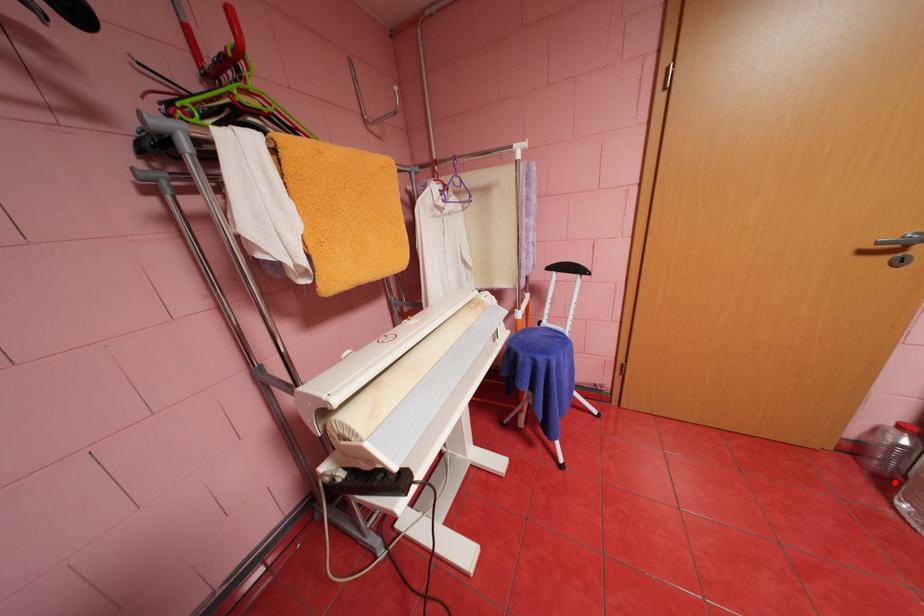
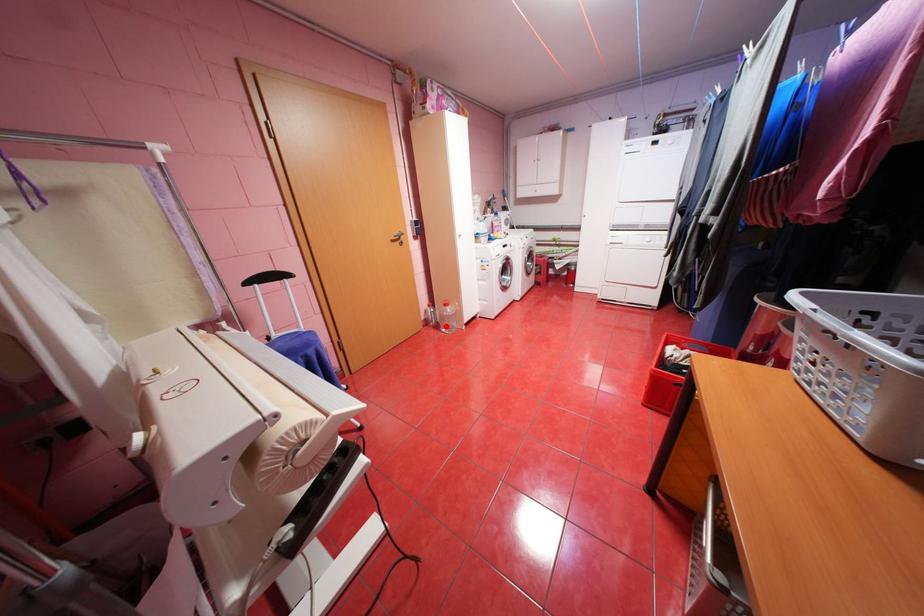
I am providing you with two images of the same scene from different viewpoints. A red point is marked on the first image and another point is marked on the second image. Are the points marked in image1 and image2 representing the same 3D position?

Yes